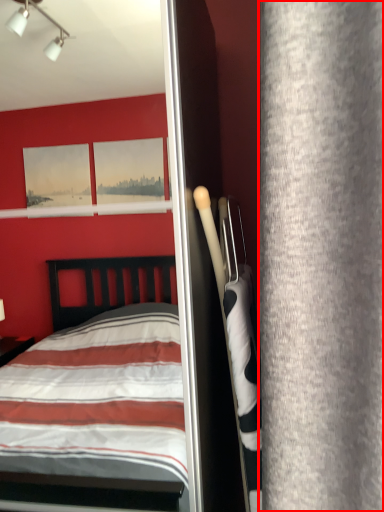
Question: From the image's perspective, where is curtain (annotated by the red box) located in relation to screen door in the image?

Choices:
 (A) below
 (B) above

Answer: (B)